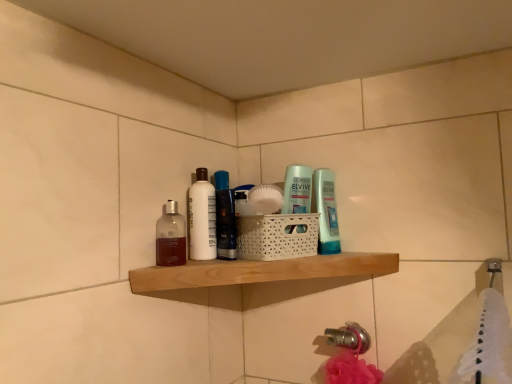
Describe the element at coordinates (260, 271) in the screenshot. I see `natural wood shelf at center` at that location.

Where is `translucent glass mouthwash at shelf center, acting as the 1th mouthwash starting from the left`? This screenshot has width=512, height=384. translucent glass mouthwash at shelf center, acting as the 1th mouthwash starting from the left is located at coordinates (170, 236).

Describe the element at coordinates (225, 217) in the screenshot. Image resolution: width=512 pixels, height=384 pixels. I see `translucent plastic mouthwash at center, which appears as the first mouthwash when viewed from the right` at that location.

What do you see at coordinates (326, 211) in the screenshot? I see `translucent plastic bottle at center, marked as the 2th toiletry in a left-to-right arrangement` at bounding box center [326, 211].

What is the approximate width of translucent plastic bottle at center, marked as the 2th toiletry in a left-to-right arrangement?

The width of translucent plastic bottle at center, marked as the 2th toiletry in a left-to-right arrangement, is 1.48 inches.

The height and width of the screenshot is (384, 512). Find the location of `white matte bottle at center, which is the second toiletry from right to left`. white matte bottle at center, which is the second toiletry from right to left is located at coordinates (202, 218).

There is a natural wood shelf at center. Identify the location of the 1st toiletry above it (from the image's perspective). pyautogui.click(x=326, y=211).

From the picture: From the image's perspective, which object appears higher, translucent plastic bottle at center, placed as the 1th toiletry when sorted from right to left, or natural wood shelf at center?

From the image's view, translucent plastic bottle at center, placed as the 1th toiletry when sorted from right to left, is above.

Do you think translucent plastic bottle at center, marked as the 2th toiletry in a left-to-right arrangement, is within natural wood shelf at center, or outside of it?

translucent plastic bottle at center, marked as the 2th toiletry in a left-to-right arrangement, is not inside natural wood shelf at center, it's outside.

Is point (327, 173) closer to camera compared to point (209, 268)?

No, (327, 173) is further to viewer.

Can you confirm if white matte bottle at center, which is the second toiletry from right to left, is positioned to the left of translucent glass mouthwash at shelf center, acting as the 1th mouthwash starting from the left?

No, white matte bottle at center, which is the second toiletry from right to left, is not to the left of translucent glass mouthwash at shelf center, acting as the 1th mouthwash starting from the left.

Is point (213, 254) closer or farther from the camera than point (165, 246)?

Point (213, 254) is farther from the camera than point (165, 246).

Is the surface of white matte bottle at center, arranged as the first toiletry when viewed from the left, in direct contact with translucent glass mouthwash at shelf center, placed as the 2th mouthwash when sorted from right to left?

Yes, white matte bottle at center, arranged as the first toiletry when viewed from the left, and translucent glass mouthwash at shelf center, placed as the 2th mouthwash when sorted from right to left, clearly make contact.

Is white matte bottle at center, arranged as the first toiletry when viewed from the left, aimed at translucent glass mouthwash at shelf center, positioned as the second mouthwash in back-to-front order?

No, white matte bottle at center, arranged as the first toiletry when viewed from the left, is not oriented towards translucent glass mouthwash at shelf center, positioned as the second mouthwash in back-to-front order.

From a real-world perspective, relative to translucent plastic mouthwash at center, which is the second mouthwash in front-to-back order, is translucent plastic bottle at center, placed as the 1th toiletry when sorted from right to left, vertically above or below?

In terms of real-world spatial position, translucent plastic bottle at center, placed as the 1th toiletry when sorted from right to left, is below translucent plastic mouthwash at center, which is the second mouthwash in front-to-back order.

From the picture: Is translucent plastic bottle at center, placed as the 1th toiletry when sorted from right to left, positioned beyond the bounds of translucent plastic mouthwash at center, which is counted as the second mouthwash, starting from the left?

Yes.

From the image's perspective, between translucent plastic bottle at center, marked as the 2th toiletry in a left-to-right arrangement, and translucent plastic mouthwash at center, which is the second mouthwash in front-to-back order, who is located below?

translucent plastic bottle at center, marked as the 2th toiletry in a left-to-right arrangement, from the image's perspective.

From the picture: Considering the relative positions of translucent plastic bottle at center, marked as the 2th toiletry in a left-to-right arrangement, and translucent plastic mouthwash at center, the first mouthwash when ordered from back to front, in the image provided, is translucent plastic bottle at center, marked as the 2th toiletry in a left-to-right arrangement, to the right of translucent plastic mouthwash at center, the first mouthwash when ordered from back to front, from the viewer's perspective?

Correct, you'll find translucent plastic bottle at center, marked as the 2th toiletry in a left-to-right arrangement, to the right of translucent plastic mouthwash at center, the first mouthwash when ordered from back to front.

Is translucent plastic mouthwash at center, which appears as the first mouthwash when viewed from the right, positioned beyond the bounds of translucent glass mouthwash at shelf center, positioned as the second mouthwash in back-to-front order?

Yes, translucent plastic mouthwash at center, which appears as the first mouthwash when viewed from the right, is outside of translucent glass mouthwash at shelf center, positioned as the second mouthwash in back-to-front order.

From the image's perspective, which is below, translucent plastic mouthwash at center, which is counted as the second mouthwash, starting from the left, or translucent glass mouthwash at shelf center, placed as the 2th mouthwash when sorted from right to left?

translucent glass mouthwash at shelf center, placed as the 2th mouthwash when sorted from right to left.

Would you say translucent plastic mouthwash at center, which appears as the first mouthwash when viewed from the right, is a long distance from translucent glass mouthwash at shelf center, positioned as the second mouthwash in back-to-front order?

No.

Could you tell me if translucent plastic mouthwash at center, which is counted as the second mouthwash, starting from the left, is turned towards translucent glass mouthwash at shelf center, positioned as the second mouthwash in back-to-front order?

No, translucent plastic mouthwash at center, which is counted as the second mouthwash, starting from the left, is not facing towards translucent glass mouthwash at shelf center, positioned as the second mouthwash in back-to-front order.

From the image's perspective, which one is positioned higher, natural wood shelf at center or translucent glass mouthwash at shelf center, acting as the 1th mouthwash starting from the left?

translucent glass mouthwash at shelf center, acting as the 1th mouthwash starting from the left, appears higher in the image.

Does natural wood shelf at center appear on the right side of translucent glass mouthwash at shelf center, the first mouthwash viewed from the front?

Correct, you'll find natural wood shelf at center to the right of translucent glass mouthwash at shelf center, the first mouthwash viewed from the front.

Which object is further away from the camera, natural wood shelf at center or translucent glass mouthwash at shelf center, acting as the 1th mouthwash starting from the left?

translucent glass mouthwash at shelf center, acting as the 1th mouthwash starting from the left.

Is point (323, 259) positioned in front of point (160, 229)?

No, it is behind (160, 229).

Find the location of a particular element. Image resolution: width=512 pixels, height=384 pixels. the 2nd mouthwash located above the natural wood shelf at center (from a real-world perspective) is located at coordinates (225, 217).

From the image's perspective, is translucent plastic mouthwash at center, the first mouthwash when ordered from back to front, positioned above or below natural wood shelf at center?

Based on their image positions, translucent plastic mouthwash at center, the first mouthwash when ordered from back to front, is located above natural wood shelf at center.

Is white matte bottle at center, arranged as the first toiletry when viewed from the left, not inside translucent plastic mouthwash at center, which is the second mouthwash in front-to-back order?

Yes, white matte bottle at center, arranged as the first toiletry when viewed from the left, is not within translucent plastic mouthwash at center, which is the second mouthwash in front-to-back order.

Does white matte bottle at center, which is the second toiletry from right to left, have a smaller size compared to translucent plastic mouthwash at center, which is counted as the second mouthwash, starting from the left?

Correct, white matte bottle at center, which is the second toiletry from right to left, occupies less space than translucent plastic mouthwash at center, which is counted as the second mouthwash, starting from the left.

Image resolution: width=512 pixels, height=384 pixels. What are the coordinates of `toiletry that is on the left side of translucent plastic mouthwash at center, which appears as the first mouthwash when viewed from the right` in the screenshot? It's located at (202, 218).

Is white matte bottle at center, arranged as the first toiletry when viewed from the left, aimed at translucent plastic mouthwash at center, which appears as the first mouthwash when viewed from the right?

No, white matte bottle at center, arranged as the first toiletry when viewed from the left, is not oriented towards translucent plastic mouthwash at center, which appears as the first mouthwash when viewed from the right.

Identify the location of toiletry that is the 1st one when counting upward from the natural wood shelf at center (from the image's perspective). (326, 211).

The image size is (512, 384). I want to click on the 2nd mouthwash in front of the white matte bottle at center, arranged as the first toiletry when viewed from the left, starting your count from the anchor, so click(x=170, y=236).

From the image, which object appears to be nearer to translucent glass mouthwash at shelf center, placed as the 2th mouthwash when sorted from right to left, translucent plastic bottle at center, placed as the 1th toiletry when sorted from right to left, or white matte bottle at center, which is the second toiletry from right to left?

The object closer to translucent glass mouthwash at shelf center, placed as the 2th mouthwash when sorted from right to left, is white matte bottle at center, which is the second toiletry from right to left.

Estimate the real-world distances between objects in this image. Which object is closer to natural wood shelf at center, white matte bottle at center, which is the second toiletry from right to left, or translucent plastic mouthwash at center, which is the second mouthwash in front-to-back order?

The object closer to natural wood shelf at center is translucent plastic mouthwash at center, which is the second mouthwash in front-to-back order.

From the picture: Looking at the image, which one is located further to natural wood shelf at center, white matte bottle at center, arranged as the first toiletry when viewed from the left, or translucent glass mouthwash at shelf center, positioned as the second mouthwash in back-to-front order?

translucent glass mouthwash at shelf center, positioned as the second mouthwash in back-to-front order, lies further to natural wood shelf at center than the other object.

From the image, which object appears to be farther from translucent plastic bottle at center, placed as the 1th toiletry when sorted from right to left, translucent glass mouthwash at shelf center, placed as the 2th mouthwash when sorted from right to left, or white matte bottle at center, which is the second toiletry from right to left?

translucent glass mouthwash at shelf center, placed as the 2th mouthwash when sorted from right to left.

When comparing their distances from natural wood shelf at center, does translucent plastic bottle at center, marked as the 2th toiletry in a left-to-right arrangement, or white matte bottle at center, which is the second toiletry from right to left, seem further?

translucent plastic bottle at center, marked as the 2th toiletry in a left-to-right arrangement, is further to natural wood shelf at center.

Looking at the image, which one is located closer to translucent glass mouthwash at shelf center, positioned as the second mouthwash in back-to-front order, translucent plastic bottle at center, placed as the 1th toiletry when sorted from right to left, or translucent plastic mouthwash at center, which is counted as the second mouthwash, starting from the left?

translucent plastic mouthwash at center, which is counted as the second mouthwash, starting from the left.

Looking at the image, which one is located closer to translucent glass mouthwash at shelf center, acting as the 1th mouthwash starting from the left, white matte bottle at center, which is the second toiletry from right to left, or translucent plastic bottle at center, placed as the 1th toiletry when sorted from right to left?

white matte bottle at center, which is the second toiletry from right to left, is positioned closer to the anchor translucent glass mouthwash at shelf center, acting as the 1th mouthwash starting from the left.

Estimate the real-world distances between objects in this image. Which object is closer to translucent plastic mouthwash at center, the first mouthwash when ordered from back to front, white matte bottle at center, which is the second toiletry from right to left, or translucent glass mouthwash at shelf center, acting as the 1th mouthwash starting from the left?

Among the two, white matte bottle at center, which is the second toiletry from right to left, is located nearer to translucent plastic mouthwash at center, the first mouthwash when ordered from back to front.

The height and width of the screenshot is (384, 512). In order to click on mouthwash situated between translucent glass mouthwash at shelf center, placed as the 2th mouthwash when sorted from right to left, and translucent plastic bottle at center, placed as the 1th toiletry when sorted from right to left, from left to right in this screenshot , I will do `click(225, 217)`.

This screenshot has height=384, width=512. I want to click on toiletry between translucent glass mouthwash at shelf center, the first mouthwash viewed from the front, and translucent plastic bottle at center, placed as the 1th toiletry when sorted from right to left, so click(x=202, y=218).

Locate an element on the screen. This screenshot has height=384, width=512. toiletry between natural wood shelf at center and white matte bottle at center, which is the second toiletry from right to left, along the z-axis is located at coordinates (326, 211).

Where is `mouthwash between white matte bottle at center, arranged as the first toiletry when viewed from the left, and translucent plastic bottle at center, placed as the 1th toiletry when sorted from right to left`? The width and height of the screenshot is (512, 384). mouthwash between white matte bottle at center, arranged as the first toiletry when viewed from the left, and translucent plastic bottle at center, placed as the 1th toiletry when sorted from right to left is located at coordinates (225, 217).